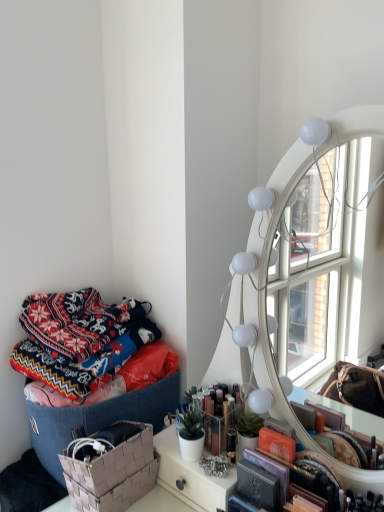
Looking at this image, what is the approximate height of beige woven basket at lower left?

beige woven basket at lower left is 3.40 inches in height.

Where is `textured woven basket at left`? textured woven basket at left is located at coordinates (98, 418).

Locate an element on the screen. Image resolution: width=384 pixels, height=512 pixels. knitted woolen blanket at left is located at coordinates (79, 339).

You are a GUI agent. You are given a task and a screenshot of the screen. Output one action in this format:
    pyautogui.click(x=<x>, y=<y>)
    Task: Click on the basket lying in front of the knitted woolen blanket at left
    Image resolution: width=384 pixels, height=512 pixels.
    Given the screenshot: What is the action you would take?
    pyautogui.click(x=110, y=467)

Choose the correct answer: Is beige woven basket at lower left inside knitted woolen blanket at left or outside it?

beige woven basket at lower left is not enclosed by knitted woolen blanket at left.

From their relative heights in the image, would you say beige woven basket at lower left is taller or shorter than knitted woolen blanket at left?

Considering their sizes, beige woven basket at lower left has less height than knitted woolen blanket at left.

Considering the points (114, 408) and (134, 499), which point is behind, point (114, 408) or point (134, 499)?

The point (114, 408) is more distant.

Considering the sizes of objects textured woven basket at left and beige woven basket at lower left in the image provided, who is smaller, textured woven basket at left or beige woven basket at lower left?

With smaller size is beige woven basket at lower left.

Is the depth of textured woven basket at left less than that of beige woven basket at lower left?

No, it is behind beige woven basket at lower left.

Measure the distance from textured woven basket at left to beige woven basket at lower left.

A distance of 10.41 centimeters exists between textured woven basket at left and beige woven basket at lower left.

Can you confirm if textured woven basket at left is bigger than knitted woolen blanket at left?

Correct, textured woven basket at left is larger in size than knitted woolen blanket at left.

Which of these two, textured woven basket at left or knitted woolen blanket at left, stands taller?

textured woven basket at left.

Which object is positioned more to the left, textured woven basket at left or knitted woolen blanket at left?

textured woven basket at left.

Where is `storage box to the left of knitted woolen blanket at left`? Image resolution: width=384 pixels, height=512 pixels. storage box to the left of knitted woolen blanket at left is located at coordinates (98, 418).

From the image's perspective, which is below, knitted woolen blanket at left or beige woven basket at lower left?

From the image's view, beige woven basket at lower left is below.

Is knitted woolen blanket at left far from beige woven basket at lower left?

They are positioned close to each other.

Who is smaller, knitted woolen blanket at left or beige woven basket at lower left?

Result: Smaller between the two is beige woven basket at lower left.

Where is `blanket behind the textured woven basket at left`? The image size is (384, 512). blanket behind the textured woven basket at left is located at coordinates (79, 339).

How different are the orientations of knitted woolen blanket at left and textured woven basket at left in degrees?

There is a 0.00125-degree angle between the facing directions of knitted woolen blanket at left and textured woven basket at left.

Is the depth of knitted woolen blanket at left greater than that of textured woven basket at left?

Yes, the depth of knitted woolen blanket at left is greater than that of textured woven basket at left.

Considering the points (88, 307) and (52, 451), which point is in front, point (88, 307) or point (52, 451)?

Positioned in front is point (52, 451).

Where is `basket in front of the textured woven basket at left`? basket in front of the textured woven basket at left is located at coordinates (110, 467).

Is beige woven basket at lower left placed right next to textured woven basket at left?

No, beige woven basket at lower left is not touching textured woven basket at left.

How different are the orientations of beige woven basket at lower left and textured woven basket at left in degrees?

The angle between the facing direction of beige woven basket at lower left and the facing direction of textured woven basket at left is 0.000416 degrees.

Does beige woven basket at lower left come behind textured woven basket at left?

No, it is in front of textured woven basket at left.

You are a GUI agent. You are given a task and a screenshot of the screen. Output one action in this format:
    pyautogui.click(x=<x>, y=<y>)
    Task: Click on the blanket behind the beige woven basket at lower left
    The image size is (384, 512).
    Given the screenshot: What is the action you would take?
    pos(79,339)

Where is `basket below the textured woven basket at left (from the image's perspective)`? basket below the textured woven basket at left (from the image's perspective) is located at coordinates (110, 467).

Which object lies nearer to the anchor point knitted woolen blanket at left, beige woven basket at lower left or textured woven basket at left?

textured woven basket at left is positioned closer to the anchor knitted woolen blanket at left.

Looking at this image, which object lies nearer to the anchor point textured woven basket at left, knitted woolen blanket at left or beige woven basket at lower left?

Among the two, beige woven basket at lower left is located nearer to textured woven basket at left.

When comparing their distances from knitted woolen blanket at left, does textured woven basket at left or beige woven basket at lower left seem closer?

textured woven basket at left.

When comparing their distances from textured woven basket at left, does beige woven basket at lower left or knitted woolen blanket at left seem further?

knitted woolen blanket at left.

Which object lies nearer to the anchor point beige woven basket at lower left, knitted woolen blanket at left or textured woven basket at left?

Among the two, textured woven basket at left is located nearer to beige woven basket at lower left.

Based on the photo, which object lies nearer to the anchor point beige woven basket at lower left, textured woven basket at left or knitted woolen blanket at left?

The object closer to beige woven basket at lower left is textured woven basket at left.

This screenshot has width=384, height=512. I want to click on storage box that lies between knitted woolen blanket at left and beige woven basket at lower left from top to bottom, so [x=98, y=418].